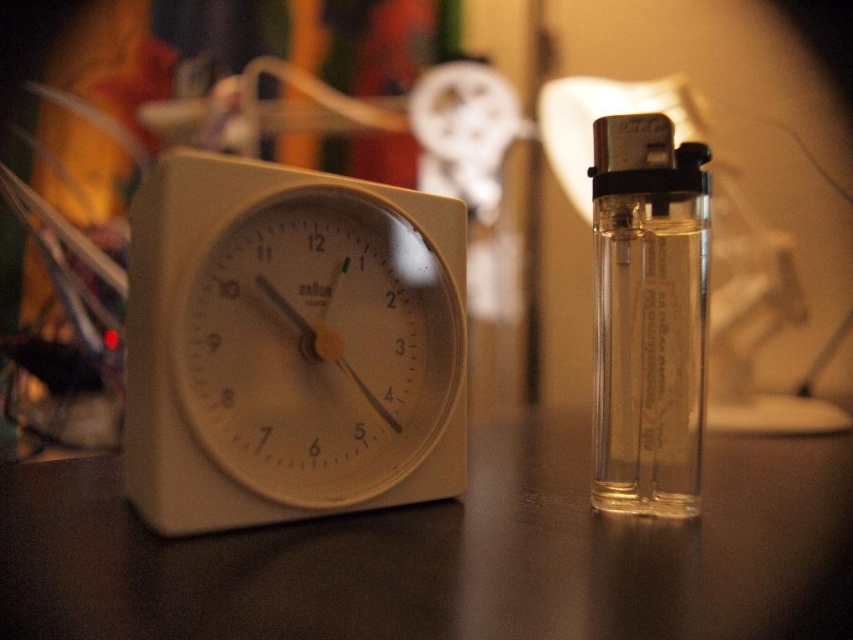
Between matte white clock at left and clear glass lighter at right, which one has more height?

With more height is clear glass lighter at right.

Is point (556, 492) more distant than point (668, 125)?

Yes, it is.

Is point (733, 467) less distant than point (622, 374)?

No.

I want to click on matte white clock at left, so click(x=450, y=556).

Can you confirm if matte white clock at left is positioned to the right of white plastic clock at left?

Yes, matte white clock at left is to the right of white plastic clock at left.

Who is taller, matte white clock at left or white plastic clock at left?

Standing taller between the two is white plastic clock at left.

Does point (1, 602) come closer to viewer compared to point (210, 225)?

Yes.

Where is `matte white clock at left`? The image size is (853, 640). matte white clock at left is located at coordinates (450, 556).

Measure the distance between point (173, 444) and camera.

A distance of 20.20 inches exists between point (173, 444) and camera.

Does white plastic clock at left have a lesser height compared to clear glass lighter at right?

Indeed, white plastic clock at left has a lesser height compared to clear glass lighter at right.

Is point (149, 353) positioned behind point (664, 157)?

No, (149, 353) is in front of (664, 157).

The image size is (853, 640). What are the coordinates of `white plastic clock at left` in the screenshot? It's located at (289, 346).